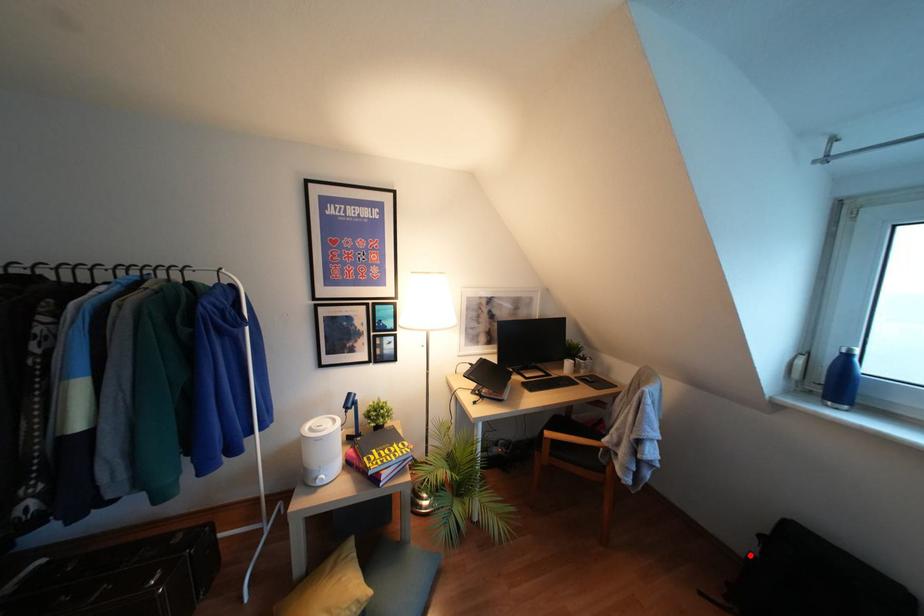
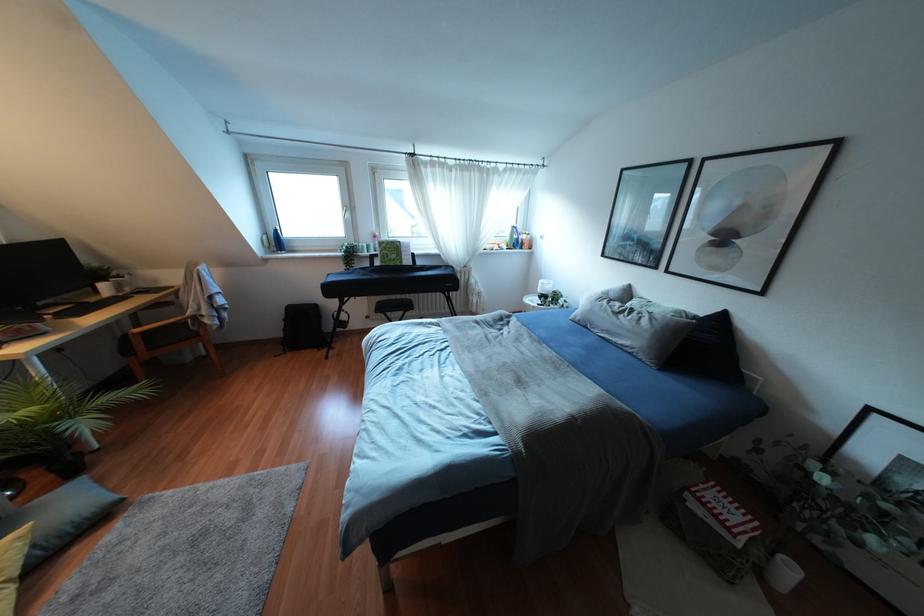
Find the pixel in the second image that matches the highlighted location in the first image.

(284, 329)